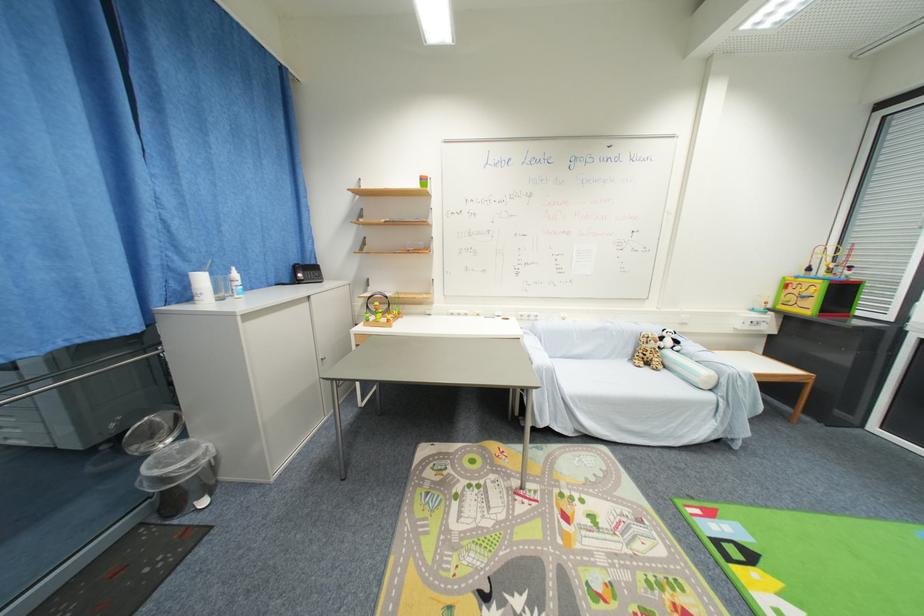
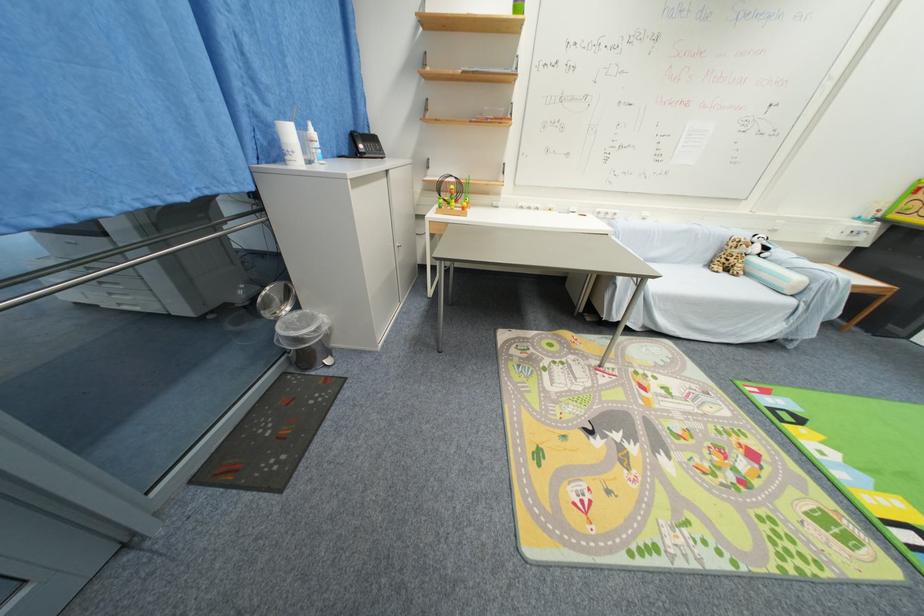
The point at (674, 344) is marked in the first image. Where is the corresponding point in the second image?

(761, 251)